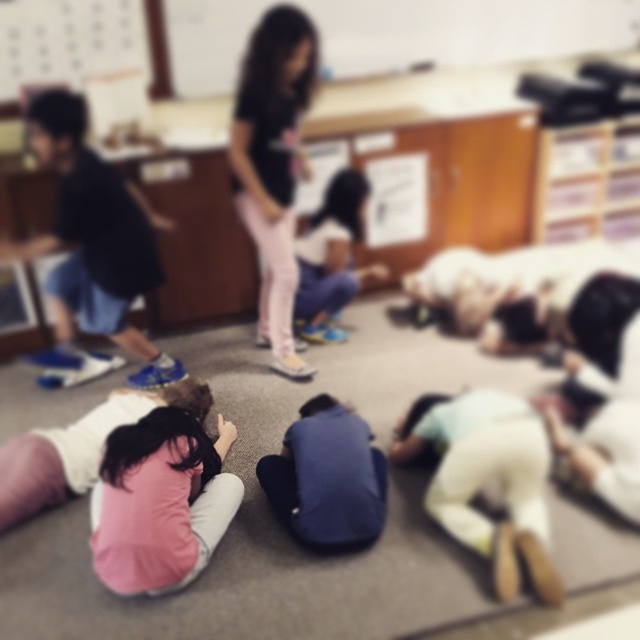
Which is below, white matte shirt at lower right or matte black shirt at center?

white matte shirt at lower right

Image resolution: width=640 pixels, height=640 pixels. What do you see at coordinates (490, 481) in the screenshot?
I see `white matte shirt at lower right` at bounding box center [490, 481].

Who is more forward, (497,429) or (264,269)?

Positioned in front is point (497,429).

At what (x,y) coordinates should I click in order to perform the action: click on white matte shirt at lower right. Please return your answer as a coordinate pair (x, y). Looking at the image, I should click on (490, 481).

Who is more distant from viewer, (x=116, y=291) or (x=506, y=588)?

The point (x=116, y=291) is behind.

Between blue athletic shoes at left and white matte shirt at lower right, which one has more height?

blue athletic shoes at left

Between point (118, 312) and point (467, 472), which one is positioned behind?

Point (118, 312)

Find the location of a particular element. The width and height of the screenshot is (640, 640). blue athletic shoes at left is located at coordinates (92, 232).

Who is taller, blue athletic shoes at left or matte black shirt at center?

matte black shirt at center

Is blue athletic shoes at left further to the viewer compared to matte black shirt at center?

No.

Is point (115, 218) positioned before point (292, 218)?

Yes, it is.

The width and height of the screenshot is (640, 640). Find the location of `blue athletic shoes at left`. blue athletic shoes at left is located at coordinates (92, 232).